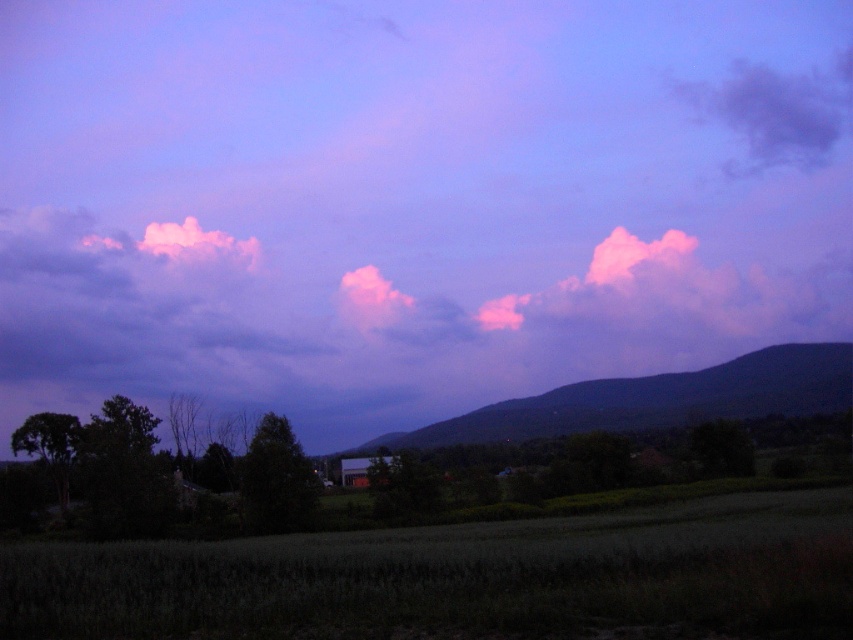
You are a painter standing in the field and want to paint the dark purple mountain at center and the purple cotton cloud at upper right. Which object should you focus on first if you want to paint the wider one first?

The dark purple mountain at center should be painted first because its width is larger than the purple cotton cloud at upper right.

Based on the photo, you are standing in the green grassy field at lower center and want to take a photo of the dark purple mountain at center. Which direction should you face to capture the mountain in your view?

You should face to the right side to capture the dark purple mountain at center because the green grassy field at lower center is positioned on the left side of the dark purple mountain at center.